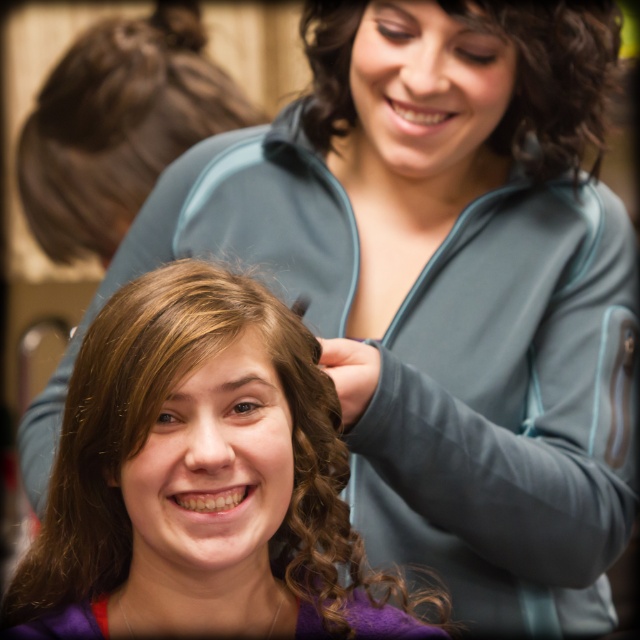
Question: Can you confirm if smooth brown hair at center is smaller than curly brown hair at upper center?

Choices:
 (A) yes
 (B) no

Answer: (B)

Question: Which object is closer to the camera taking this photo?

Choices:
 (A) curly brown hair at upper center
 (B) brown hair at upper left

Answer: (A)

Question: Which point is farther to the camera?

Choices:
 (A) (58, 152)
 (B) (118, 512)

Answer: (A)

Question: In this image, where is smooth brown hair at center located relative to curly brown hair at upper center?

Choices:
 (A) below
 (B) above

Answer: (A)

Question: Which of these objects is positioned closest to the brown hair at upper left?

Choices:
 (A) smooth brown hair at center
 (B) curly brown hair at upper center

Answer: (B)

Question: Does smooth brown hair at center have a lesser width compared to brown hair at upper left?

Choices:
 (A) no
 (B) yes

Answer: (B)